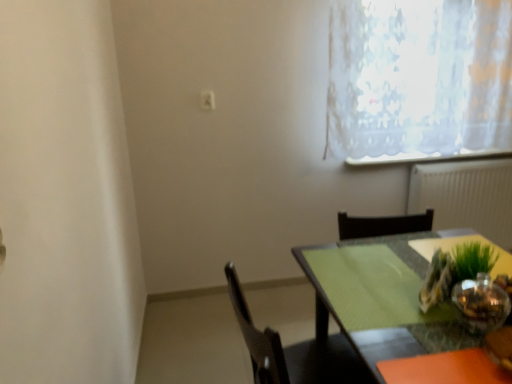
Question: Is white lace curtain at upper right far from green matte table at lower right?

Choices:
 (A) no
 (B) yes

Answer: (B)

Question: From the image's perspective, would you say white lace curtain at upper right is positioned over green matte table at lower right?

Choices:
 (A) yes
 (B) no

Answer: (A)

Question: Does white lace curtain at upper right appear on the left side of green matte table at lower right?

Choices:
 (A) yes
 (B) no

Answer: (B)

Question: From a real-world perspective, does white lace curtain at upper right sit lower than green matte table at lower right?

Choices:
 (A) yes
 (B) no

Answer: (B)

Question: Is white lace curtain at upper right aimed at green matte table at lower right?

Choices:
 (A) no
 (B) yes

Answer: (A)

Question: Considering the relative sizes of white lace curtain at upper right and green matte table at lower right in the image provided, is white lace curtain at upper right smaller than green matte table at lower right?

Choices:
 (A) no
 (B) yes

Answer: (B)

Question: Is the depth of green glass table at center, the first chair in the top-to-bottom sequence, less than that of black matte chair at lower center, which is the 1th chair in bottom-to-top order?

Choices:
 (A) no
 (B) yes

Answer: (A)

Question: From a real-world perspective, does green glass table at center, the first chair in the top-to-bottom sequence, stand above black matte chair at lower center, which is the 1th chair in bottom-to-top order?

Choices:
 (A) no
 (B) yes

Answer: (B)

Question: Is green glass table at center, the first chair in the top-to-bottom sequence, at the right side of black matte chair at lower center, which appears as the second chair when viewed from the top?

Choices:
 (A) no
 (B) yes

Answer: (B)

Question: Is black matte chair at lower center, which appears as the second chair when viewed from the top, inside green glass table at center, the first chair in the top-to-bottom sequence?

Choices:
 (A) yes
 (B) no

Answer: (B)

Question: Can you confirm if green glass table at center, the first chair in the top-to-bottom sequence, is wider than black matte chair at lower center, which appears as the second chair when viewed from the top?

Choices:
 (A) no
 (B) yes

Answer: (A)

Question: Considering the relative sizes of green glass table at center, the second chair in the bottom-to-top sequence, and black matte chair at lower center, which appears as the second chair when viewed from the top, in the image provided, is green glass table at center, the second chair in the bottom-to-top sequence, bigger than black matte chair at lower center, which appears as the second chair when viewed from the top,?

Choices:
 (A) no
 (B) yes

Answer: (A)

Question: From a real-world perspective, is white textured radiator at right located beneath white lace curtain at upper right?

Choices:
 (A) yes
 (B) no

Answer: (A)